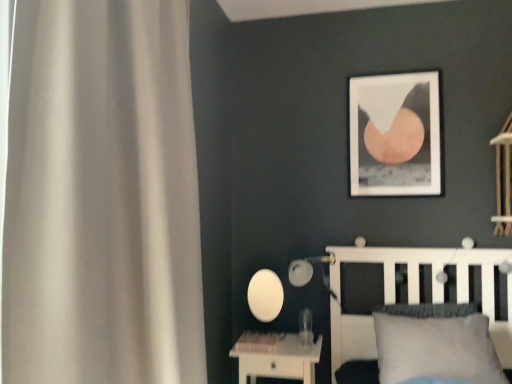
Question: Considering the positions of white matte bed at lower right and white glossy nightstand at lower center in the image, is white matte bed at lower right wider or thinner than white glossy nightstand at lower center?

Choices:
 (A) wide
 (B) thin

Answer: (A)

Question: From a real-world perspective, is white matte bed at lower right positioned above or below white glossy nightstand at lower center?

Choices:
 (A) below
 (B) above

Answer: (B)

Question: Estimate the real-world distances between objects in this image. Which object is closer to the white soft pillow at lower right?

Choices:
 (A) white glossy nightstand at lower center
 (B) matte white table lamp at center
 (C) white matte picture frame at upper center
 (D) white matte curtain at left
 (E) white matte bed at lower right

Answer: (E)

Question: Which of these objects is positioned farthest from the white glossy nightstand at lower center?

Choices:
 (A) white soft pillow at lower right
 (B) white matte bed at lower right
 (C) white matte picture frame at upper center
 (D) matte white table lamp at center
 (E) white matte curtain at left

Answer: (E)